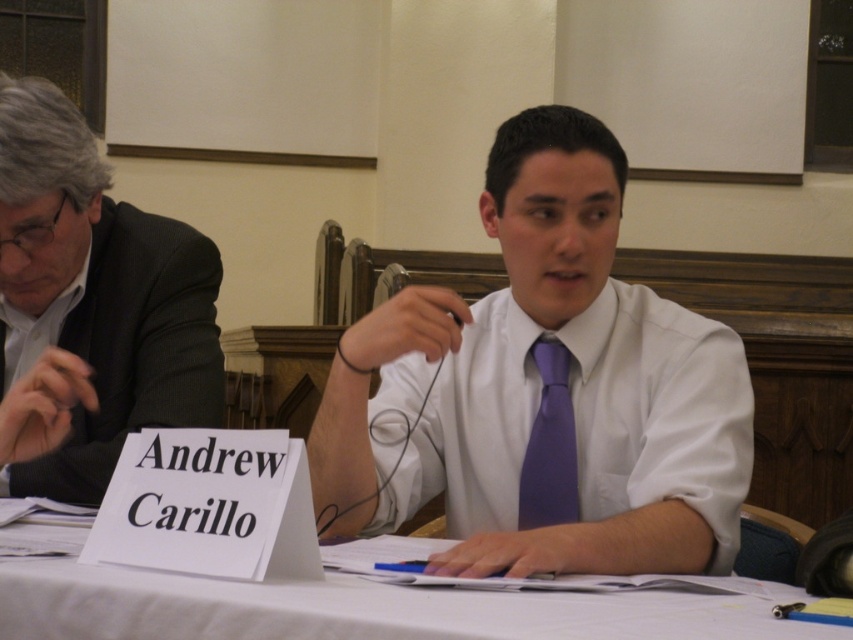
Question: Which object appears farthest from the camera in this image?

Choices:
 (A) dark gray suit at left
 (B) white paper at center

Answer: (A)

Question: Does white glossy shirt at center have a smaller size compared to white paper at center?

Choices:
 (A) no
 (B) yes

Answer: (A)

Question: Is white glossy shirt at center smaller than dark gray suit at left?

Choices:
 (A) yes
 (B) no

Answer: (B)

Question: Can you confirm if dark gray suit at left is thinner than white paper at center?

Choices:
 (A) no
 (B) yes

Answer: (B)

Question: Which of these objects is positioned closest to the white paper at center?

Choices:
 (A) white glossy shirt at center
 (B) purple satin tie at center

Answer: (A)

Question: Which is farther from the white paper at center?

Choices:
 (A) white glossy shirt at center
 (B) dark gray suit at left
 (C) purple satin tie at center

Answer: (B)